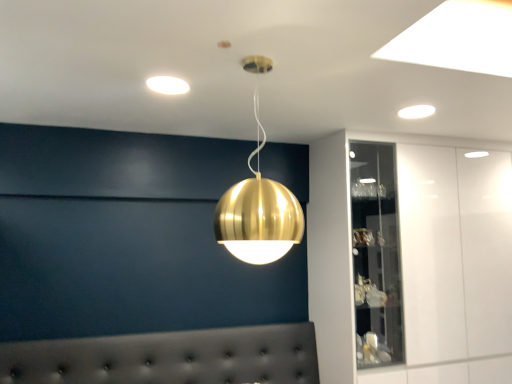
In the scene shown: What is the approximate height of white glossy cabinet at upper right?

It is 1.94 meters.

The image size is (512, 384). What do you see at coordinates (167, 85) in the screenshot?
I see `matte white light fixture at upper center, positioned as the third lamp in bottom-to-top order` at bounding box center [167, 85].

In the scene shown: In order to face white glossy light fixture at upper right, acting as the first lamp starting from the right, should I rotate leftwards or rightwards?

Turn right by 20.447 degrees to look at white glossy light fixture at upper right, acting as the first lamp starting from the right.

Locate an element on the screen. This screenshot has height=384, width=512. white glossy cabinet at upper right is located at coordinates (420, 260).

Is gold metallic sphere at center, which is the first lamp from front to back, far away from matte white light fixture at upper center, which is the third lamp from right to left?

Actually, gold metallic sphere at center, which is the first lamp from front to back, and matte white light fixture at upper center, which is the third lamp from right to left, are a little close together.

Considering the positions of objects gold metallic sphere at center, arranged as the third lamp when viewed from the back, and matte white light fixture at upper center, positioned as the 1th lamp in top-to-bottom order, in the image provided, who is in front, gold metallic sphere at center, arranged as the third lamp when viewed from the back, or matte white light fixture at upper center, positioned as the 1th lamp in top-to-bottom order,?

gold metallic sphere at center, arranged as the third lamp when viewed from the back, is more forward.

From the picture: Is gold metallic sphere at center, arranged as the second lamp when viewed from the right, shorter than matte white light fixture at upper center, the second lamp viewed from the back?

Incorrect, the height of gold metallic sphere at center, arranged as the second lamp when viewed from the right, does not fall short of that of matte white light fixture at upper center, the second lamp viewed from the back.

Considering the points (178, 93) and (178, 370), which point is in front, point (178, 93) or point (178, 370)?

Point (178, 93)

Is matte white light fixture at upper center, positioned as the third lamp in bottom-to-top order, with tufted leather headboard at lower center?

They are not placed beside each other.

Considering the sizes of matte white light fixture at upper center, the 2th lamp positioned from the front, and tufted leather headboard at lower center in the image, is matte white light fixture at upper center, the 2th lamp positioned from the front, bigger or smaller than tufted leather headboard at lower center?

Considering their sizes, matte white light fixture at upper center, the 2th lamp positioned from the front, takes up less space than tufted leather headboard at lower center.

Considering the relative positions of matte white light fixture at upper center, positioned as the third lamp in bottom-to-top order, and tufted leather headboard at lower center in the image provided, is matte white light fixture at upper center, positioned as the third lamp in bottom-to-top order, to the left or to the right of tufted leather headboard at lower center?

Clearly, matte white light fixture at upper center, positioned as the third lamp in bottom-to-top order, is on the right of tufted leather headboard at lower center in the image.

Between white glossy cabinet at upper right and gold metallic sphere at center, acting as the 2th lamp starting from the left, which one appears on the right side from the viewer's perspective?

white glossy cabinet at upper right is more to the right.

Which object is further away from the camera taking this photo, white glossy cabinet at upper right or gold metallic sphere at center, marked as the third lamp in a top-to-bottom arrangement?

white glossy cabinet at upper right is further away from the camera.

Can you confirm if white glossy light fixture at upper right, the first lamp viewed from the back, is positioned to the right of matte white light fixture at upper center, the 2th lamp positioned from the front?

Indeed, white glossy light fixture at upper right, the first lamp viewed from the back, is positioned on the right side of matte white light fixture at upper center, the 2th lamp positioned from the front.

Considering the sizes of objects white glossy light fixture at upper right, acting as the first lamp starting from the right, and matte white light fixture at upper center, the second lamp viewed from the back, in the image provided, who is shorter, white glossy light fixture at upper right, acting as the first lamp starting from the right, or matte white light fixture at upper center, the second lamp viewed from the back,?

With less height is matte white light fixture at upper center, the second lamp viewed from the back.

Can you confirm if white glossy light fixture at upper right, acting as the third lamp starting from the front, is thinner than matte white light fixture at upper center, positioned as the third lamp in bottom-to-top order?

Yes.

Looking at this image, from the image's perspective, which one is positioned higher, white glossy light fixture at upper right, positioned as the third lamp in left-to-right order, or gold metallic sphere at center, arranged as the second lamp when viewed from the right?

white glossy light fixture at upper right, positioned as the third lamp in left-to-right order, from the image's perspective.

Which is behind, white glossy light fixture at upper right, the second lamp when ordered from bottom to top, or gold metallic sphere at center, arranged as the third lamp when viewed from the back?

white glossy light fixture at upper right, the second lamp when ordered from bottom to top.

This screenshot has width=512, height=384. There is a gold metallic sphere at center, marked as the third lamp in a top-to-bottom arrangement. Find the location of `the 2nd lamp above it (from a real-world perspective)`. the 2nd lamp above it (from a real-world perspective) is located at coordinates (416, 111).

At what (x,y) coordinates should I click in order to perform the action: click on lamp that is the 3rd one above the tufted leather headboard at lower center (from a real-world perspective). Please return your answer as a coordinate pair (x, y). The height and width of the screenshot is (384, 512). Looking at the image, I should click on (416, 111).

Considering the relative sizes of white glossy light fixture at upper right, which is counted as the 2th lamp, starting from the top, and tufted leather headboard at lower center in the image provided, is white glossy light fixture at upper right, which is counted as the 2th lamp, starting from the top, shorter than tufted leather headboard at lower center?

Yes, white glossy light fixture at upper right, which is counted as the 2th lamp, starting from the top, is shorter than tufted leather headboard at lower center.

Which of these two, white glossy light fixture at upper right, the first lamp viewed from the back, or tufted leather headboard at lower center, is wider?

Wider between the two is tufted leather headboard at lower center.

Considering the sizes of white glossy cabinet at upper right and white glossy light fixture at upper right, the second lamp when ordered from bottom to top, in the image, is white glossy cabinet at upper right bigger or smaller than white glossy light fixture at upper right, the second lamp when ordered from bottom to top,?

Considering their sizes, white glossy cabinet at upper right takes up more space than white glossy light fixture at upper right, the second lamp when ordered from bottom to top.

How many degrees apart are the facing directions of white glossy cabinet at upper right and white glossy light fixture at upper right, positioned as the third lamp in left-to-right order?

The angular difference between white glossy cabinet at upper right and white glossy light fixture at upper right, positioned as the third lamp in left-to-right order, is 0.683 degrees.

Which is more to the right, white glossy cabinet at upper right or white glossy light fixture at upper right, positioned as the third lamp in left-to-right order?

Positioned to the right is white glossy cabinet at upper right.

Which point is more distant from viewer, (446, 371) or (435, 110)?

Positioned behind is point (446, 371).

The height and width of the screenshot is (384, 512). Find the location of `lamp located on the left of gold metallic sphere at center, marked as the third lamp in a top-to-bottom arrangement`. lamp located on the left of gold metallic sphere at center, marked as the third lamp in a top-to-bottom arrangement is located at coordinates (167, 85).

The height and width of the screenshot is (384, 512). Identify the location of furniture that appears below the matte white light fixture at upper center, positioned as the 1th lamp in top-to-bottom order (from the image's perspective). (169, 357).

Considering their positions, is matte white light fixture at upper center, the 2th lamp positioned from the front, positioned closer to white glossy light fixture at upper right, which is counted as the 2th lamp, starting from the top, than white glossy cabinet at upper right?

white glossy cabinet at upper right is closer to white glossy light fixture at upper right, which is counted as the 2th lamp, starting from the top.

From the image, which object appears to be nearer to tufted leather headboard at lower center, white glossy light fixture at upper right, acting as the third lamp starting from the front, or matte white light fixture at upper center, the 2th lamp positioned from the front?

Based on the image, matte white light fixture at upper center, the 2th lamp positioned from the front, appears to be nearer to tufted leather headboard at lower center.

Estimate the real-world distances between objects in this image. Which object is further from white glossy cabinet at upper right, matte white light fixture at upper center, positioned as the third lamp in bottom-to-top order, or white glossy light fixture at upper right, the second lamp when ordered from bottom to top?

matte white light fixture at upper center, positioned as the third lamp in bottom-to-top order, is positioned further to the anchor white glossy cabinet at upper right.

Which object lies nearer to the anchor point gold metallic sphere at center, acting as the 2th lamp starting from the left, tufted leather headboard at lower center or white glossy cabinet at upper right?

tufted leather headboard at lower center.

Looking at the image, which one is located further to white glossy light fixture at upper right, acting as the first lamp starting from the right, tufted leather headboard at lower center or gold metallic sphere at center, which is the first lamp from bottom to top?

tufted leather headboard at lower center lies further to white glossy light fixture at upper right, acting as the first lamp starting from the right, than the other object.

Considering their positions, is tufted leather headboard at lower center positioned further to gold metallic sphere at center, acting as the 2th lamp starting from the left, than matte white light fixture at upper center, the second lamp viewed from the back?

→ The object further to gold metallic sphere at center, acting as the 2th lamp starting from the left, is tufted leather headboard at lower center.

When comparing their distances from white glossy light fixture at upper right, positioned as the third lamp in left-to-right order, does white glossy cabinet at upper right or gold metallic sphere at center, arranged as the third lamp when viewed from the back, seem closer?

white glossy cabinet at upper right.

Based on their spatial positions, is tufted leather headboard at lower center or matte white light fixture at upper center, which is the third lamp from right to left, closer to white glossy light fixture at upper right, which is counted as the 2th lamp, starting from the top?

matte white light fixture at upper center, which is the third lamp from right to left, lies closer to white glossy light fixture at upper right, which is counted as the 2th lamp, starting from the top, than the other object.

You are a GUI agent. You are given a task and a screenshot of the screen. Output one action in this format:
    pyautogui.click(x=<x>, y=<y>)
    Task: Click on the lamp between gold metallic sphere at center, arranged as the third lamp when viewed from the back, and white glossy cabinet at upper right, in the horizontal direction
    The width and height of the screenshot is (512, 384).
    Given the screenshot: What is the action you would take?
    pyautogui.click(x=416, y=111)

Where is `lamp that lies between white glossy light fixture at upper right, the second lamp when ordered from bottom to top, and tufted leather headboard at lower center from top to bottom`? The width and height of the screenshot is (512, 384). lamp that lies between white glossy light fixture at upper right, the second lamp when ordered from bottom to top, and tufted leather headboard at lower center from top to bottom is located at coordinates point(258,214).

This screenshot has width=512, height=384. Find the location of `lamp between matte white light fixture at upper center, positioned as the third lamp in bottom-to-top order, and white glossy light fixture at upper right, which is counted as the 2th lamp, starting from the top, from left to right`. lamp between matte white light fixture at upper center, positioned as the third lamp in bottom-to-top order, and white glossy light fixture at upper right, which is counted as the 2th lamp, starting from the top, from left to right is located at coordinates (258, 214).